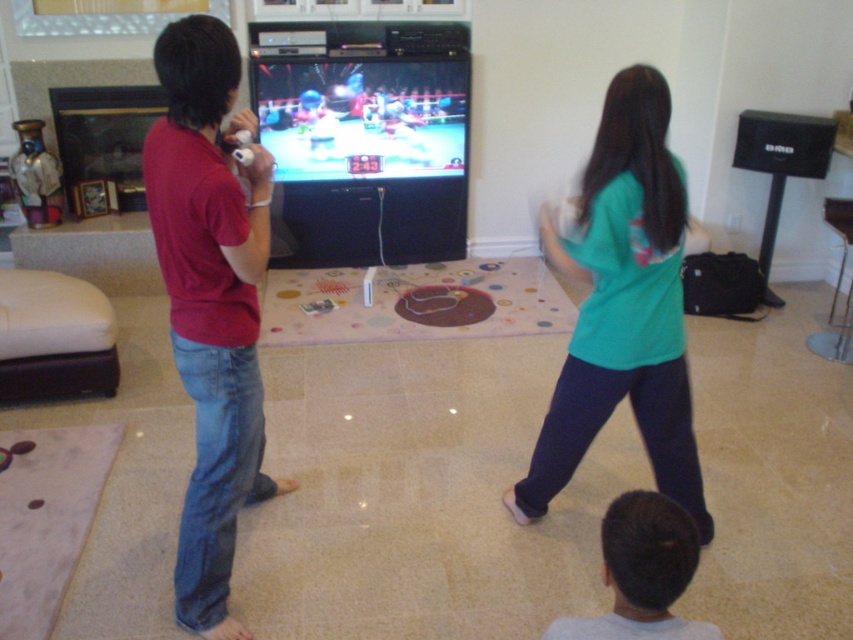
In the scene shown: Does matte red shirt at left have a smaller size compared to dark brown hair at lower center?

Actually, matte red shirt at left might be larger than dark brown hair at lower center.

Is point (230, 324) positioned behind point (625, 595)?

That is True.

Identify the location of matte red shirt at left. pos(210,301).

This screenshot has width=853, height=640. What do you see at coordinates (624, 305) in the screenshot? I see `teal t-shirt at center` at bounding box center [624, 305].

From the picture: Does teal t-shirt at center appear on the right side of dark brown hair at lower center?

Yes, teal t-shirt at center is to the right of dark brown hair at lower center.

Locate an element on the screen. This screenshot has width=853, height=640. teal t-shirt at center is located at coordinates (624, 305).

Does matte red shirt at left come in front of teal t-shirt at center?

Yes, matte red shirt at left is closer to the viewer.

Which is behind, point (227, 484) or point (572, 257)?

The point (572, 257) is more distant.

Find the location of a particular element. matte red shirt at left is located at coordinates (210, 301).